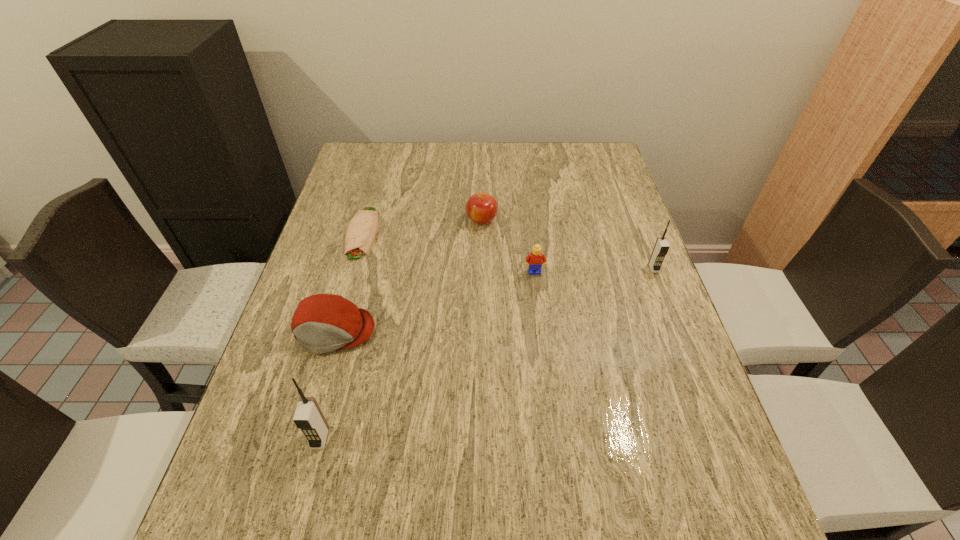
Please determine a free point for an extra cellular_telephone to ensure balance. Please provide its 2D coordinates. Your answer should be formatted as a tuple, i.e. [(x, y)], where the tuple contains the x and y coordinates of a point satisfying the conditions above.

[(514, 340)]